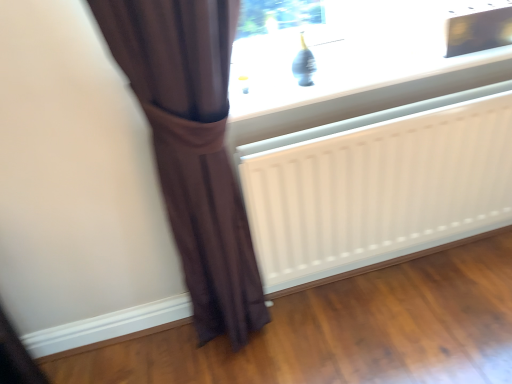
Locate an element on the screen. matte glass window at upper center is located at coordinates (351, 53).

What do you see at coordinates (192, 149) in the screenshot? I see `brown fabric curtain at left` at bounding box center [192, 149].

In order to face brown fabric curtain at left, should I rotate leftwards or rightwards?

Turn left by 2.479 degrees to look at brown fabric curtain at left.

The height and width of the screenshot is (384, 512). In order to click on matte glass window at upper center in this screenshot , I will do `click(351, 53)`.

Is matte glass window at upper center facing towards brown fabric curtain at left?

No, matte glass window at upper center is not turned towards brown fabric curtain at left.

Is the position of matte glass window at upper center more distant than that of brown fabric curtain at left?

Yes, matte glass window at upper center is further from the camera.

The image size is (512, 384). I want to click on curtain that is under the matte glass window at upper center (from a real-world perspective), so click(192, 149).

Is the position of brown fabric curtain at left less distant than that of white matte radiator at lower center?

Yes, it is in front of white matte radiator at lower center.

From the image's perspective, between brown fabric curtain at left and white matte radiator at lower center, which one is located above?

white matte radiator at lower center, from the image's perspective.

Based on the photo, is brown fabric curtain at left oriented away from white matte radiator at lower center?

That's right, brown fabric curtain at left is facing away from white matte radiator at lower center.

What are the coordinates of `radiator above the brown fabric curtain at left (from the image's perspective)` in the screenshot? It's located at [x=379, y=185].

Considering the relative sizes of brown fabric curtain at left and matte glass window at upper center in the image provided, is brown fabric curtain at left bigger than matte glass window at upper center?

Yes, brown fabric curtain at left is bigger than matte glass window at upper center.

Would you say brown fabric curtain at left is outside matte glass window at upper center?

That's correct, brown fabric curtain at left is outside of matte glass window at upper center.

From the image's perspective, which one is positioned lower, brown fabric curtain at left or matte glass window at upper center?

brown fabric curtain at left appears lower in the image.

Does brown fabric curtain at left have a greater height compared to matte glass window at upper center?

Yes, brown fabric curtain at left is taller than matte glass window at upper center.

From the image's perspective, between white matte radiator at lower center and brown fabric curtain at left, who is located below?

brown fabric curtain at left.

Can you confirm if white matte radiator at lower center is shorter than brown fabric curtain at left?

Correct, white matte radiator at lower center is not as tall as brown fabric curtain at left.

How many degrees apart are the facing directions of white matte radiator at lower center and brown fabric curtain at left?

The angle between the facing direction of white matte radiator at lower center and the facing direction of brown fabric curtain at left is 1.11 degrees.

Would you say white matte radiator at lower center is inside or outside matte glass window at upper center?

white matte radiator at lower center lies outside matte glass window at upper center.

Who is taller, white matte radiator at lower center or matte glass window at upper center?

white matte radiator at lower center.

Can you confirm if white matte radiator at lower center is smaller than matte glass window at upper center?

Incorrect, white matte radiator at lower center is not smaller in size than matte glass window at upper center.

Considering the relative sizes of white matte radiator at lower center and matte glass window at upper center in the image provided, is white matte radiator at lower center wider than matte glass window at upper center?

No.

From a real-world perspective, relative to white matte radiator at lower center, is matte glass window at upper center vertically above or below?

From a real-world perspective, matte glass window at upper center is physically above white matte radiator at lower center.

In order to click on radiator directly beneath the matte glass window at upper center (from a real-world perspective) in this screenshot , I will do click(379, 185).

Which point is more forward, (264, 78) or (386, 114)?

The point (386, 114) is closer to the camera.

Are matte glass window at upper center and white matte radiator at lower center making contact?

No.

Identify the location of curtain that appears in front of the matte glass window at upper center. (192, 149).

The height and width of the screenshot is (384, 512). I want to click on radiator that is behind the brown fabric curtain at left, so click(379, 185).

Looking at the image, which one is located closer to brown fabric curtain at left, matte glass window at upper center or white matte radiator at lower center?

white matte radiator at lower center is closer to brown fabric curtain at left.

Considering their positions, is white matte radiator at lower center positioned further to matte glass window at upper center than brown fabric curtain at left?

brown fabric curtain at left lies further to matte glass window at upper center than the other object.

Based on their spatial positions, is white matte radiator at lower center or matte glass window at upper center closer to brown fabric curtain at left?

white matte radiator at lower center is closer to brown fabric curtain at left.

Estimate the real-world distances between objects in this image. Which object is closer to matte glass window at upper center, brown fabric curtain at left or white matte radiator at lower center?

white matte radiator at lower center lies closer to matte glass window at upper center than the other object.

Estimate the real-world distances between objects in this image. Which object is further from white matte radiator at lower center, matte glass window at upper center or brown fabric curtain at left?

brown fabric curtain at left lies further to white matte radiator at lower center than the other object.

Based on their spatial positions, is brown fabric curtain at left or matte glass window at upper center closer to white matte radiator at lower center?

matte glass window at upper center is positioned closer to the anchor white matte radiator at lower center.

You are a GUI agent. You are given a task and a screenshot of the screen. Output one action in this format:
    pyautogui.click(x=<x>, y=<y>)
    Task: Click on the window between brown fabric curtain at left and white matte radiator at lower center
    The image size is (512, 384).
    Given the screenshot: What is the action you would take?
    pyautogui.click(x=351, y=53)